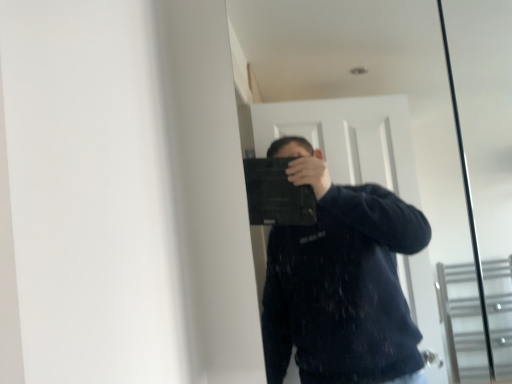
Question: Should I look upward or downward to see black matte laptop at center?

Choices:
 (A) up
 (B) down

Answer: (A)